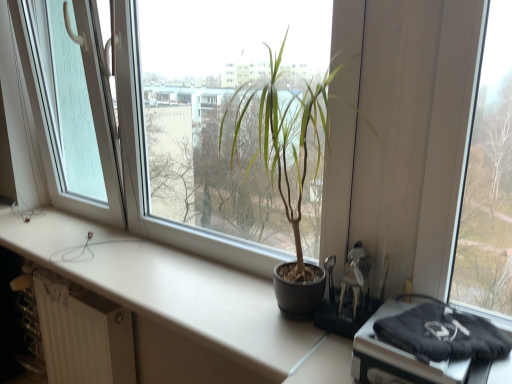
Question: Is transparent glass door at left at the left side of white textured radiator at lower left?

Choices:
 (A) no
 (B) yes

Answer: (B)

Question: Is white textured radiator at lower left completely or partially inside transparent glass door at left?

Choices:
 (A) no
 (B) yes

Answer: (A)

Question: From the image's perspective, is transparent glass door at left beneath white textured radiator at lower left?

Choices:
 (A) no
 (B) yes

Answer: (A)

Question: Is transparent glass door at left not within white textured radiator at lower left?

Choices:
 (A) no
 (B) yes

Answer: (B)

Question: Is transparent glass door at left behind white textured radiator at lower left?

Choices:
 (A) no
 (B) yes

Answer: (A)

Question: Is point tap(52, 195) positioned closer to the camera than point tap(284, 309)?

Choices:
 (A) closer
 (B) farther

Answer: (B)

Question: In terms of size, does transparent glass door at left appear bigger or smaller than matte black pot at center?

Choices:
 (A) small
 (B) big

Answer: (B)

Question: From the image's perspective, is transparent glass door at left positioned above or below matte black pot at center?

Choices:
 (A) below
 (B) above

Answer: (B)

Question: Considering the positions of transparent glass door at left and matte black pot at center in the image, is transparent glass door at left wider or thinner than matte black pot at center?

Choices:
 (A) thin
 (B) wide

Answer: (A)

Question: Does point (259, 110) appear closer or farther from the camera than point (50, 345)?

Choices:
 (A) farther
 (B) closer

Answer: (A)

Question: Considering the relative positions of matte black pot at center and white textured radiator at lower left in the image provided, is matte black pot at center to the left or to the right of white textured radiator at lower left?

Choices:
 (A) left
 (B) right

Answer: (B)

Question: From their relative heights in the image, would you say matte black pot at center is taller or shorter than white textured radiator at lower left?

Choices:
 (A) tall
 (B) short

Answer: (A)

Question: Considering their positions, is matte black pot at center located in front of or behind white textured radiator at lower left?

Choices:
 (A) front
 (B) behind

Answer: (A)

Question: Looking at their shapes, would you say white matte counter top at center is wider or thinner than transparent glass door at left?

Choices:
 (A) wide
 (B) thin

Answer: (A)

Question: Considering the positions of white matte counter top at center and transparent glass door at left in the image, is white matte counter top at center taller or shorter than transparent glass door at left?

Choices:
 (A) tall
 (B) short

Answer: (B)